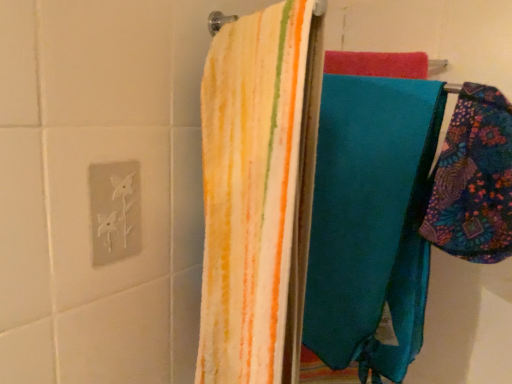
The image size is (512, 384). What do you see at coordinates (473, 180) in the screenshot?
I see `floral patchwork fabric at right` at bounding box center [473, 180].

The image size is (512, 384). Identify the location of floral patchwork fabric at right. [x=473, y=180].

What is the approximate height of floral patchwork fabric at right?

floral patchwork fabric at right is 22.88 centimeters tall.

Measure the distance between point (490, 155) and camera.

The distance of point (490, 155) from camera is 19.96 inches.

What is the approximate width of floral patchwork fabric at right?

It is 14.05 centimeters.

Where is `white matte electric outlet at upper left`? The image size is (512, 384). white matte electric outlet at upper left is located at coordinates (115, 211).

Consider the image. What is the approximate width of white matte electric outlet at upper left?

It is 1.18 centimeters.

What do you see at coordinates (115, 211) in the screenshot? I see `white matte electric outlet at upper left` at bounding box center [115, 211].

Image resolution: width=512 pixels, height=384 pixels. Identify the location of floral patchwork fabric at right. (473, 180).

Consider the image. Is white matte electric outlet at upper left to the left or to the right of floral patchwork fabric at right in the image?

In the image, white matte electric outlet at upper left appears on the left side of floral patchwork fabric at right.

Considering the relative positions of white matte electric outlet at upper left and floral patchwork fabric at right in the image provided, is white matte electric outlet at upper left in front of floral patchwork fabric at right?

No, it is not.

Is point (109, 249) more distant than point (494, 230)?

Yes, it is.

From the image's perspective, which one is positioned higher, white matte electric outlet at upper left or floral patchwork fabric at right?

floral patchwork fabric at right.

From a real-world perspective, is white matte electric outlet at upper left on floral patchwork fabric at right?

No, from a real-world perspective, white matte electric outlet at upper left is not on top of floral patchwork fabric at right.

Considering the sizes of white matte electric outlet at upper left and floral patchwork fabric at right in the image, is white matte electric outlet at upper left wider or thinner than floral patchwork fabric at right?

Considering their sizes, white matte electric outlet at upper left looks slimmer than floral patchwork fabric at right.

Between white matte electric outlet at upper left and floral patchwork fabric at right, which one has more height?

Standing taller between the two is floral patchwork fabric at right.

Is white matte electric outlet at upper left bigger or smaller than floral patchwork fabric at right?

white matte electric outlet at upper left is smaller than floral patchwork fabric at right.

Is white matte electric outlet at upper left not inside floral patchwork fabric at right?

Absolutely, white matte electric outlet at upper left is external to floral patchwork fabric at right.

Is white matte electric outlet at upper left in contact with floral patchwork fabric at right?

white matte electric outlet at upper left and floral patchwork fabric at right are not in contact.

From the picture: Is white matte electric outlet at upper left facing away from floral patchwork fabric at right?

No.

What's the angular difference between white matte electric outlet at upper left and floral patchwork fabric at right's facing directions?

17.5 degrees separate the facing orientations of white matte electric outlet at upper left and floral patchwork fabric at right.

How distant is white matte electric outlet at upper left from floral patchwork fabric at right?

They are 17.79 inches apart.

Where is `towel lying in front of the white matte electric outlet at upper left`? This screenshot has width=512, height=384. towel lying in front of the white matte electric outlet at upper left is located at coordinates (473, 180).

Between floral patchwork fabric at right and white matte electric outlet at upper left, which one appears on the right side from the viewer's perspective?

From the viewer's perspective, floral patchwork fabric at right appears more on the right side.

Relative to white matte electric outlet at upper left, is floral patchwork fabric at right in front or behind?

floral patchwork fabric at right is in front of white matte electric outlet at upper left.

Is point (483, 257) closer or farther from the camera than point (106, 250)?

Point (483, 257) is closer to the camera than point (106, 250).

From the image's perspective, is floral patchwork fabric at right beneath white matte electric outlet at upper left?

Actually, floral patchwork fabric at right appears above white matte electric outlet at upper left in the image.

From a real-world perspective, relative to white matte electric outlet at upper left, is floral patchwork fabric at right vertically above or below?

In terms of real-world spatial position, floral patchwork fabric at right is above white matte electric outlet at upper left.

Which of these two, floral patchwork fabric at right or white matte electric outlet at upper left, is thinner?

With smaller width is white matte electric outlet at upper left.

From their relative heights in the image, would you say floral patchwork fabric at right is taller or shorter than white matte electric outlet at upper left?

floral patchwork fabric at right is taller than white matte electric outlet at upper left.

From the picture: Between floral patchwork fabric at right and white matte electric outlet at upper left, which one has larger size?

floral patchwork fabric at right.

Is white matte electric outlet at upper left inside floral patchwork fabric at right?

Actually, white matte electric outlet at upper left is outside floral patchwork fabric at right.

Are floral patchwork fabric at right and white matte electric outlet at upper left making contact?

They are not placed beside each other.

Consider the image. Is floral patchwork fabric at right oriented towards white matte electric outlet at upper left?

No, floral patchwork fabric at right is not aimed at white matte electric outlet at upper left.

From the picture: Can you tell me how much floral patchwork fabric at right and white matte electric outlet at upper left differ in facing direction?

floral patchwork fabric at right and white matte electric outlet at upper left are facing 17.5 degrees away from each other.

Measure the distance from floral patchwork fabric at right to white matte electric outlet at upper left.

floral patchwork fabric at right is 17.79 inches from white matte electric outlet at upper left.

This screenshot has height=384, width=512. Identify the location of electric outlet below the floral patchwork fabric at right (from the image's perspective). (115, 211).

Identify the location of towel that is in front of the white matte electric outlet at upper left. The width and height of the screenshot is (512, 384). (473, 180).

In the image, there is a white matte electric outlet at upper left. Find the location of `towel above it (from the image's perspective)`. towel above it (from the image's perspective) is located at coordinates (473, 180).